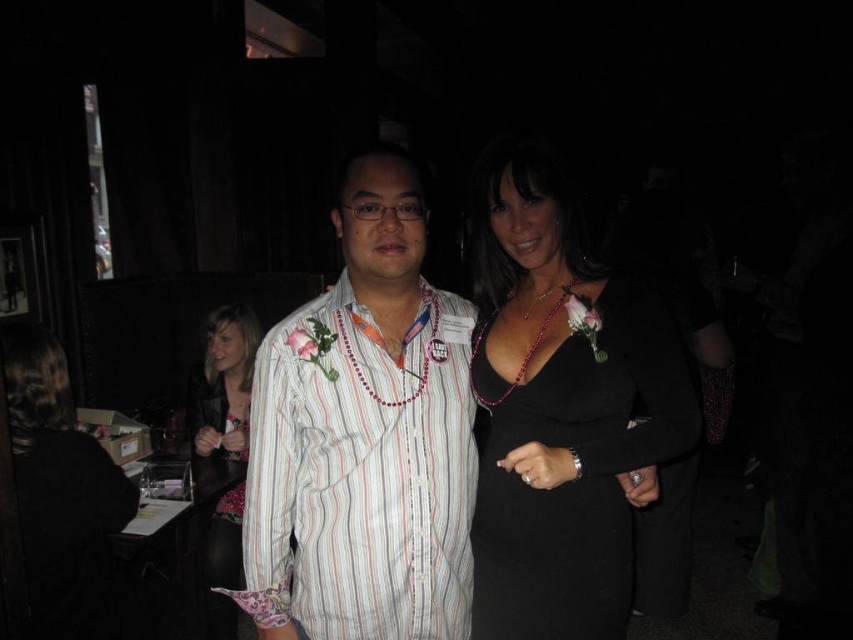
You are standing in the dimly lit room where the two people are. You want to locate the point at coordinates (555, 490). Which object is this point located on?

The point at coordinates (555, 490) is located on the black satin dress at right.

You are at a party and want to give a gift to the person wearing the black satin dress at right. The gift must be placed on the black leather ring at center. Can you directly hand the gift to the dress without moving the ring?

The black satin dress at right is to the right of the black leather ring at center, so you can directly hand the gift to the person wearing the black satin dress at right by placing it on the black leather ring at center since the ring is positioned between them.

Looking at this image, you are a photographer at a dimly lit event and need to adjust your camera settings to capture both the black satin dress at center and the black leather ring at center clearly. Which object should you focus on first to ensure proper exposure, considering their positions?

The black satin dress at center is positioned on the right side of black leather ring at center. Since the dress is further to the right, you should focus on the black leather ring at center first to ensure proper exposure before adjusting for the dress.